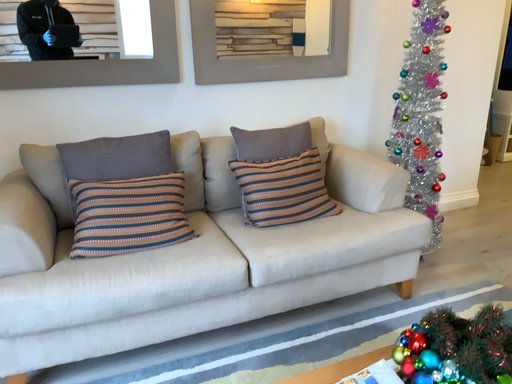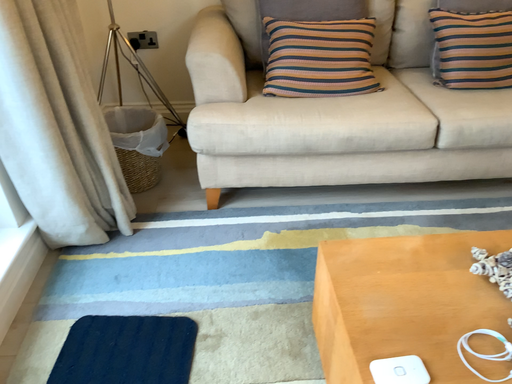
Question: How did the camera likely rotate when shooting the video?

Choices:
 (A) rotated upward
 (B) rotated downward

Answer: (B)